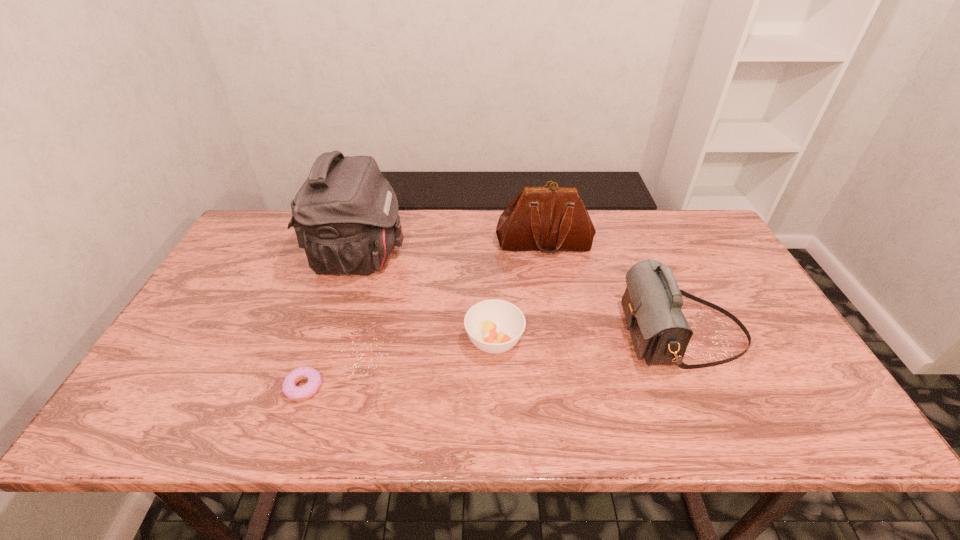
Where is `object present at the right edge`? The height and width of the screenshot is (540, 960). object present at the right edge is located at coordinates (652, 302).

Image resolution: width=960 pixels, height=540 pixels. What are the coordinates of `free space at the far edge of the desktop` in the screenshot? It's located at (625, 210).

In the image, there is a desktop. Where is `free space at the near edge`? free space at the near edge is located at coordinates (348, 431).

Locate an element on the screen. free space at the left edge of the desktop is located at coordinates (230, 259).

You are a GUI agent. You are given a task and a screenshot of the screen. Output one action in this format:
    pyautogui.click(x=<x>, y=<y>)
    Task: Click on the free region at the right edge of the desktop
    Image resolution: width=960 pixels, height=540 pixels.
    Given the screenshot: What is the action you would take?
    pyautogui.click(x=745, y=389)

I want to click on blank region between the soup bowl and the tallest shoulder bag, so click(426, 299).

This screenshot has width=960, height=540. In order to click on vacant area that lies between the tallest shoulder bag and the doughnut in this screenshot , I will do `click(331, 322)`.

I want to click on empty space that is in between the leftmost shoulder bag and the fourth tallest object, so click(x=426, y=299).

This screenshot has width=960, height=540. I want to click on free space between the doughnut and the tallest shoulder bag, so click(x=331, y=322).

I want to click on vacant point located between the tallest shoulder bag and the second shortest object, so click(x=426, y=299).